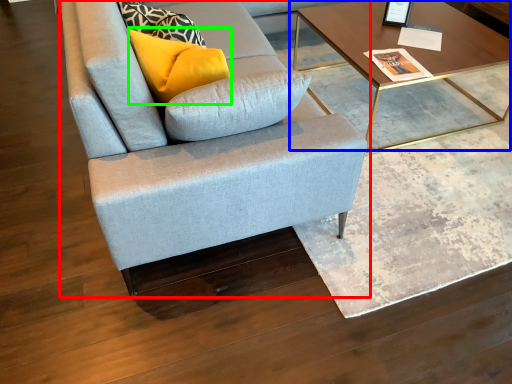
Question: Which object is the farthest from studio couch (highlighted by a red box)? Choose among these: coffee table (highlighted by a blue box) or pillow (highlighted by a green box).

Choices:
 (A) coffee table
 (B) pillow

Answer: (A)